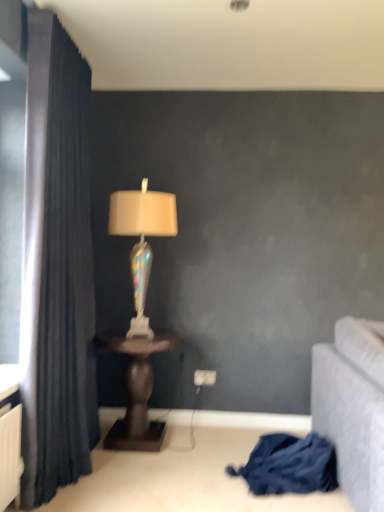
Question: From the image's perspective, is blue fabric at lower right above or below brown wooden table at center?

Choices:
 (A) below
 (B) above

Answer: (A)

Question: From a real-world perspective, is blue fabric at lower right above or below brown wooden table at center?

Choices:
 (A) below
 (B) above

Answer: (A)

Question: Which is farther from the brown wooden table at center?

Choices:
 (A) blue fabric at lower right
 (B) dark blue fabric curtain at left
 (C) iridescent glass lamp at center

Answer: (A)

Question: Estimate the real-world distances between objects in this image. Which object is farther from the blue fabric at lower right?

Choices:
 (A) brown wooden table at center
 (B) iridescent glass lamp at center
 (C) dark blue fabric curtain at left

Answer: (C)